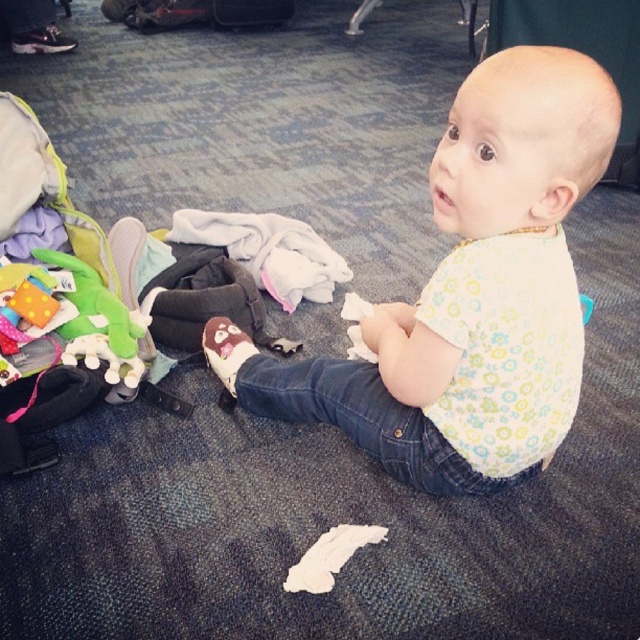
Looking at this image, does white cotton bib at center have a larger size compared to white soft cloth at center?

Yes, white cotton bib at center is bigger than white soft cloth at center.

Is white cotton bib at center to the left of white soft cloth at center from the viewer's perspective?

A: In fact, white cotton bib at center is to the right of white soft cloth at center.

Is point (557, 81) behind point (301, 285)?

No, it is in front of (301, 285).

Where is `white cotton bib at center`? This screenshot has height=640, width=640. white cotton bib at center is located at coordinates (468, 292).

Between white cotton bib at center and black hard suitcase at center, which one has more height?

With more height is white cotton bib at center.

Is point (609, 154) in front of point (250, 0)?

Yes, it is.

Does point (536, 433) come closer to viewer compared to point (227, 4)?

Yes, it is in front of point (227, 4).

At what (x,y) coordinates should I click in order to perform the action: click on white cotton bib at center. Please return your answer as a coordinate pair (x, y). Looking at the image, I should click on (468, 292).

Who is more distant from viewer, (x=241, y=216) or (x=209, y=19)?

The point (x=209, y=19) is behind.

Is the position of white soft cloth at center more distant than that of black hard suitcase at center?

No.

Which is behind, point (211, 224) or point (243, 22)?

The point (243, 22) is behind.

Locate an element on the screen. The width and height of the screenshot is (640, 640). white soft cloth at center is located at coordinates (268, 252).